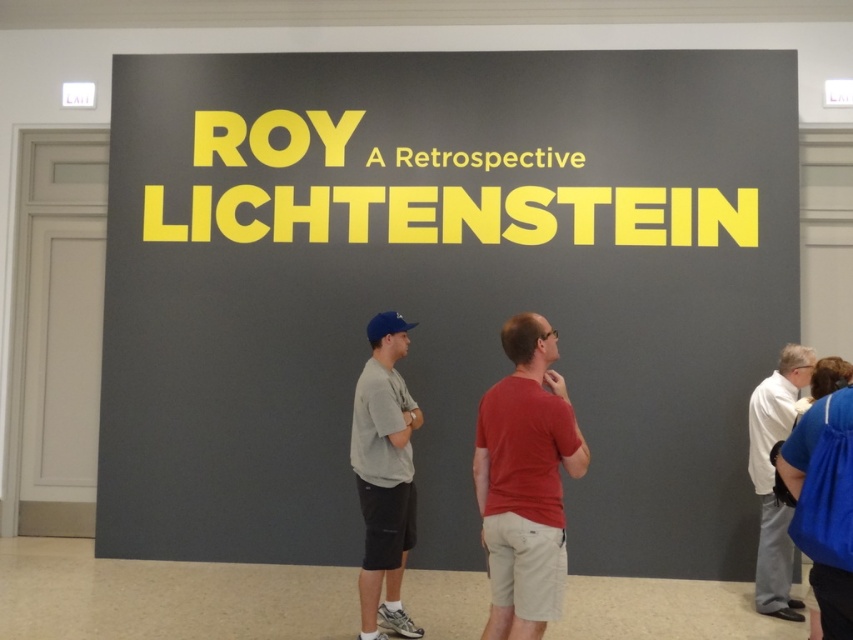
Question: Is gray fabric shirt at center closer to the viewer compared to white matte shirt at lower right?

Choices:
 (A) no
 (B) yes

Answer: (B)

Question: Which object is positioned farthest from the gray fabric shirt at center?

Choices:
 (A) white matte shirt at lower right
 (B) matte yellow text at center

Answer: (A)

Question: Can you confirm if matte yellow text at center is wider than white matte shirt at lower right?

Choices:
 (A) yes
 (B) no

Answer: (A)

Question: Considering the real-world distances, which object is closest to the red cotton shirt at center?

Choices:
 (A) matte yellow text at center
 (B) gray fabric shirt at center
 (C) white matte shirt at lower right

Answer: (B)

Question: Which object appears farthest from the camera in this image?

Choices:
 (A) matte yellow text at center
 (B) gray fabric shirt at center

Answer: (A)

Question: Where is matte yellow text at center located in relation to white matte shirt at lower right in the image?

Choices:
 (A) above
 (B) below

Answer: (A)